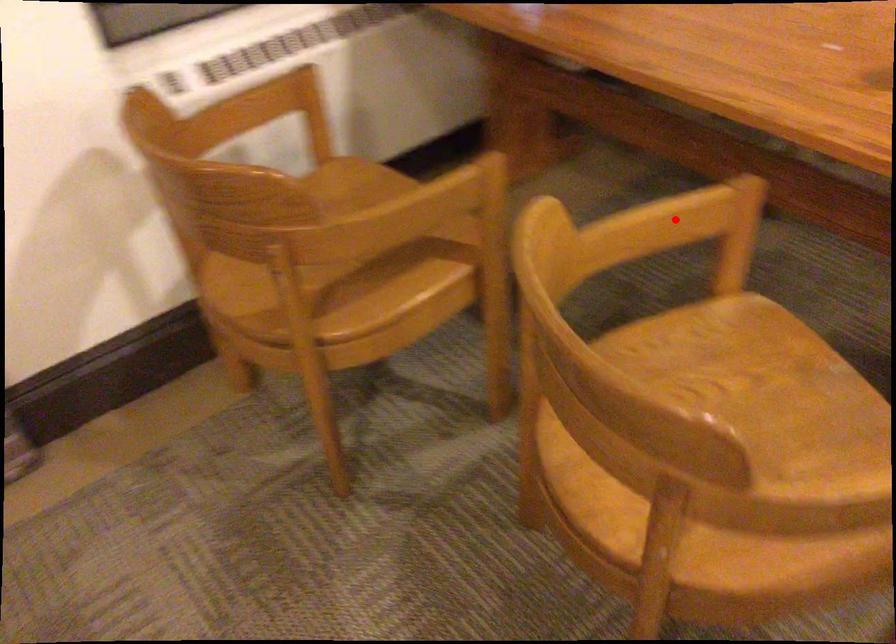
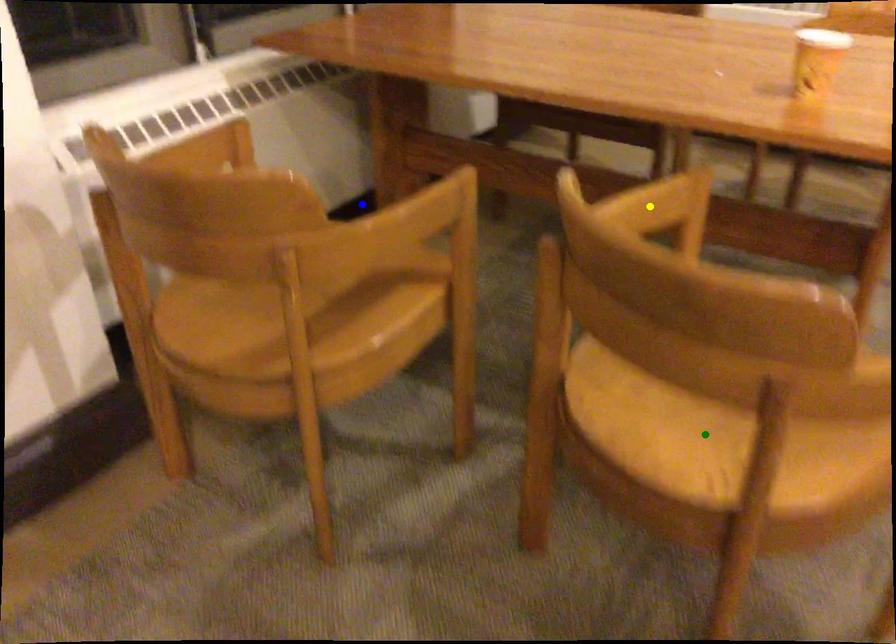
Question: I am providing you with two images of the same scene from different viewpoints. A red point is marked on the first image. You are given multiple points on the second image. Which spot in image 2 lines up with the point in image 1?

Choices:
 (A) green point
 (B) yellow point
 (C) blue point

Answer: (B)